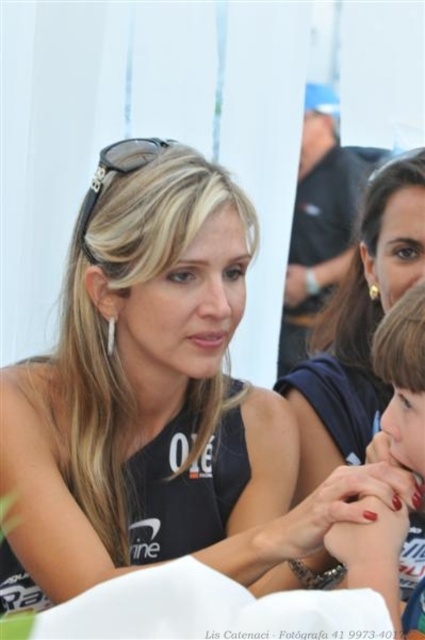
Who is more forward, (175, 212) or (397, 365)?

Point (397, 365)

Locate an element on the screen. The height and width of the screenshot is (640, 425). matte black tank top at center is located at coordinates (158, 403).